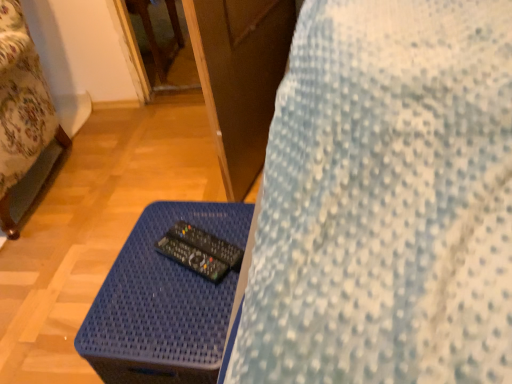
Question: From the image's perspective, relative to black plastic remote at center, arranged as the second control when viewed from the top, is blue woven table at lower center above or below?

Choices:
 (A) below
 (B) above

Answer: (A)

Question: Is blue woven table at lower center bigger or smaller than black plastic remote at center, placed as the 1th control when sorted from bottom to top?

Choices:
 (A) small
 (B) big

Answer: (B)

Question: Which is farther from the black plastic remote at center, arranged as the second control when viewed from the top?

Choices:
 (A) black plastic remote at center, which is the 1th control in top-to-bottom order
 (B) blue woven table at lower center
 (C) wooden bed frame at left

Answer: (C)

Question: Which object is the farthest from the blue woven table at lower center?

Choices:
 (A) black plastic remote at center, arranged as the second control when viewed from the top
 (B) black plastic remote at center, which is the 1th control in top-to-bottom order
 (C) wooden bed frame at left

Answer: (C)